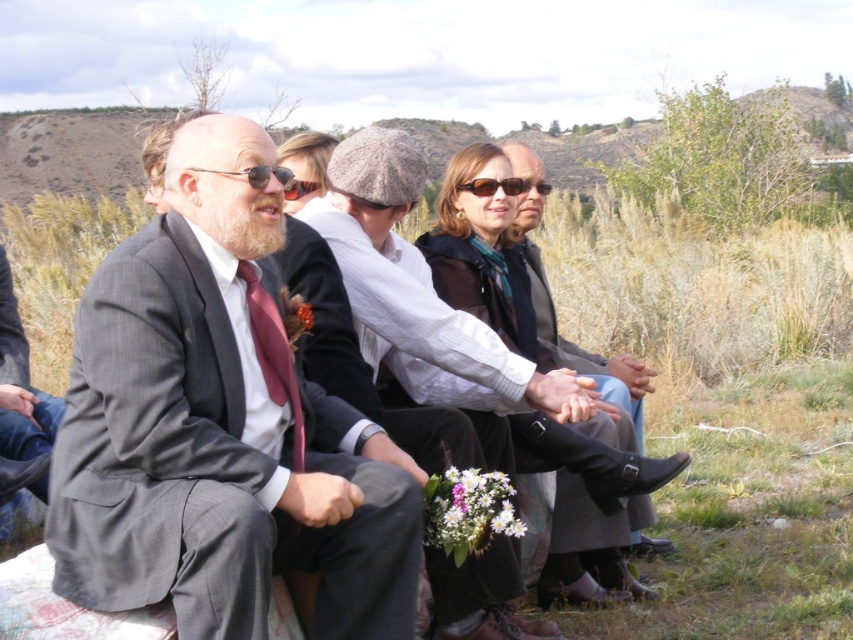
You are standing in front of the group and want to determine which of the two points, point (170,172) or point (514,145), is nearer to you. Based on the scene description, which point is closer?

Point (170,172) is closer to the viewer than point (514,145).

From the picture: You are standing at the position of the man in the dark gray suit. Which object is closer to you, the point at (x=317, y=508) or the woman in the brown jacket and blue scarf?

The point at (x=317, y=508) is 10.44 feet from viewer, so the point at (x=317, y=508) is closer to you than the woman in the brown jacket and blue scarf.

You are standing in front of the scene and want to know the spatial relationship between the matte gray suit at left and the leather boots at center. Which one is positioned lower in the image?

The matte gray suit at left is positioned lower in the image because it is below the leather boots at center.